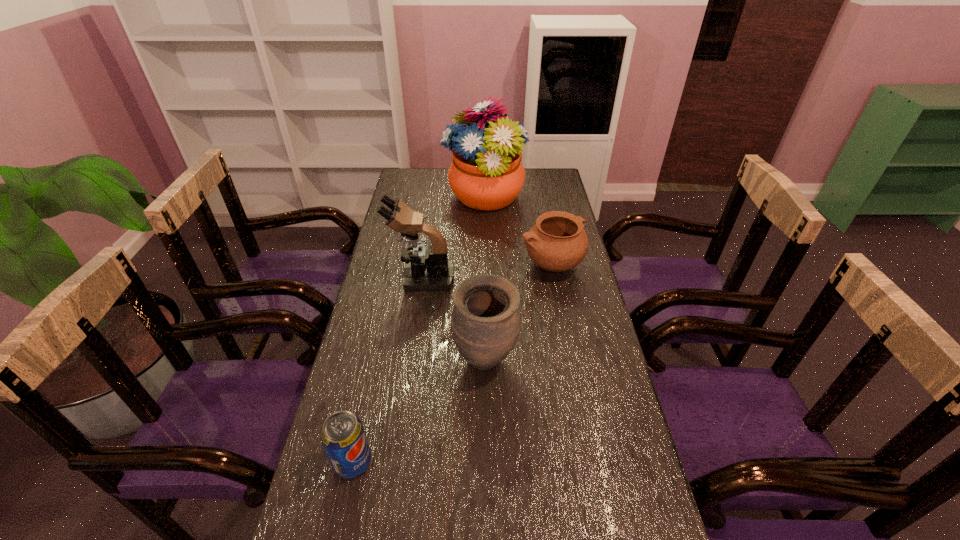
Where is `vacant space located 0.070m on the back of the pottery`? This screenshot has height=540, width=960. vacant space located 0.070m on the back of the pottery is located at coordinates (546, 236).

Locate an element on the screen. Image resolution: width=960 pixels, height=540 pixels. vacant area located on the right of the soda is located at coordinates (537, 462).

Image resolution: width=960 pixels, height=540 pixels. Find the location of `object located at the far edge`. object located at the far edge is located at coordinates (486, 173).

Image resolution: width=960 pixels, height=540 pixels. I want to click on microscope present at the left edge, so click(427, 269).

Identify the location of soda that is at the left edge. tap(343, 437).

Identify the location of object that is at the right edge. The image size is (960, 540). (557, 242).

This screenshot has width=960, height=540. Find the location of `vacant space at the left edge of the desktop`. vacant space at the left edge of the desktop is located at coordinates (389, 253).

Identify the location of free space at the right edge. click(660, 539).

Locate an element on the screen. The image size is (960, 540). vacant space at the far left corner of the desktop is located at coordinates (428, 181).

This screenshot has height=540, width=960. Find the location of `blank area at the far right corner`. blank area at the far right corner is located at coordinates (538, 181).